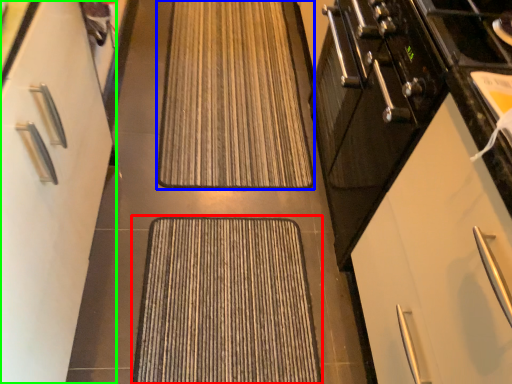
Question: Which is farther away from doormat (highlighted by a red box)? doormat (highlighted by a blue box) or cabinetry (highlighted by a green box)?

Choices:
 (A) doormat
 (B) cabinetry

Answer: (A)